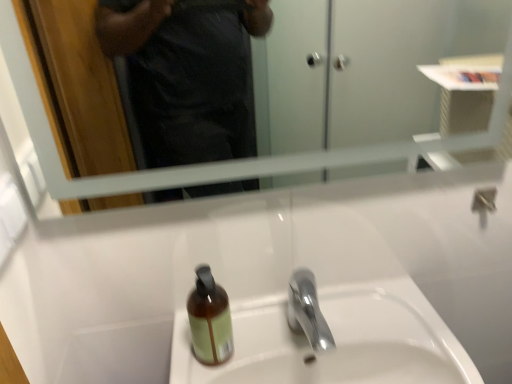
Question: Is the surface of clear glass mirror at upper center in direct contact with white ceramic sink at center?

Choices:
 (A) no
 (B) yes

Answer: (A)

Question: Does clear glass mirror at upper center have a greater width compared to white ceramic sink at center?

Choices:
 (A) no
 (B) yes

Answer: (A)

Question: Considering the relative positions of clear glass mirror at upper center and white ceramic sink at center in the image provided, is clear glass mirror at upper center in front of white ceramic sink at center?

Choices:
 (A) no
 (B) yes

Answer: (B)

Question: Does clear glass mirror at upper center have a greater height compared to white ceramic sink at center?

Choices:
 (A) no
 (B) yes

Answer: (B)

Question: Is clear glass mirror at upper center looking in the opposite direction of white ceramic sink at center?

Choices:
 (A) no
 (B) yes

Answer: (A)

Question: Is clear glass mirror at upper center positioned behind white ceramic sink at center?

Choices:
 (A) yes
 (B) no

Answer: (B)

Question: Does brown glass bottle at center lie in front of white ceramic sink at center?

Choices:
 (A) no
 (B) yes

Answer: (A)

Question: Does brown glass bottle at center appear on the right side of white ceramic sink at center?

Choices:
 (A) yes
 (B) no

Answer: (B)

Question: Is brown glass bottle at center directly adjacent to white ceramic sink at center?

Choices:
 (A) yes
 (B) no

Answer: (B)

Question: Does brown glass bottle at center have a greater width compared to white ceramic sink at center?

Choices:
 (A) yes
 (B) no

Answer: (B)

Question: Is brown glass bottle at center to the left of white ceramic sink at center from the viewer's perspective?

Choices:
 (A) no
 (B) yes

Answer: (B)

Question: Is white ceramic sink at center surrounded by brown glass bottle at center?

Choices:
 (A) no
 (B) yes

Answer: (A)

Question: Is polished chrome faucet at center smaller than clear glass mirror at upper center?

Choices:
 (A) yes
 (B) no

Answer: (A)